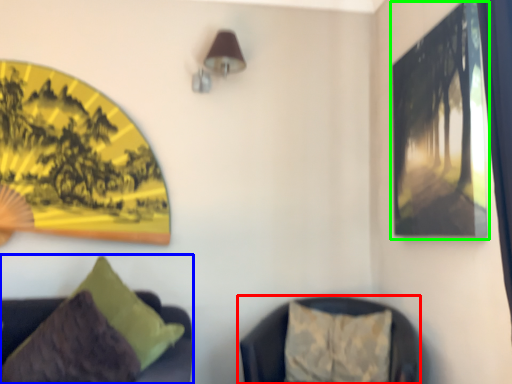
Question: Which is nearer to the furniture (highlighted by a red box)? furniture (highlighted by a blue box) or picture frame (highlighted by a green box).

Choices:
 (A) furniture
 (B) picture frame

Answer: (A)